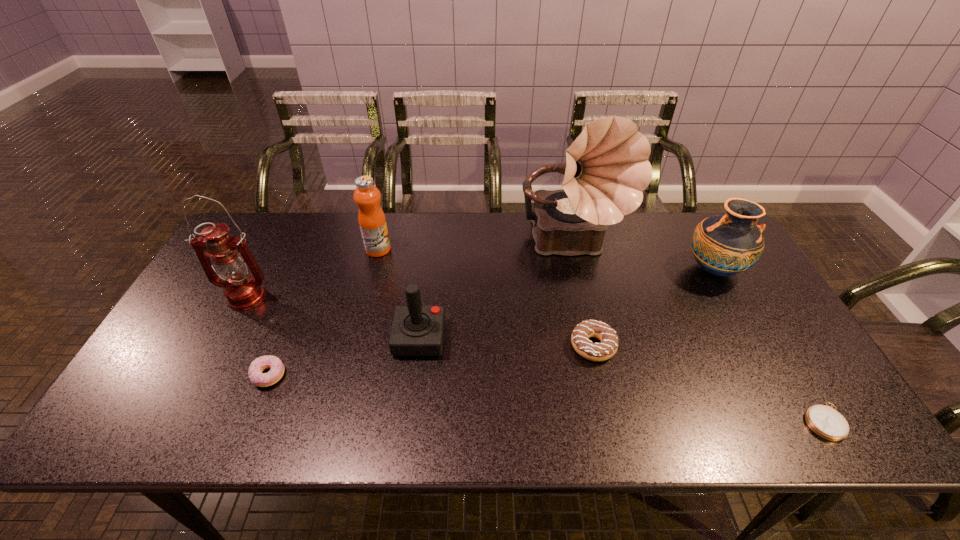
At what (x,y) coordinates should I click in order to perform the action: click on record player located in the far edge section of the desktop. Please return your answer as a coordinate pair (x, y). Looking at the image, I should click on (606, 169).

You are a GUI agent. You are given a task and a screenshot of the screen. Output one action in this format:
    pyautogui.click(x=<x>, y=<y>)
    Task: Click on the fruit juice that is at the far edge
    The image size is (960, 540).
    Given the screenshot: What is the action you would take?
    pyautogui.click(x=372, y=222)

Image resolution: width=960 pixels, height=540 pixels. What are the coordinates of `pottery that is at the far edge` in the screenshot? It's located at pos(724,245).

The height and width of the screenshot is (540, 960). Find the location of `object positioned at the near edge`. object positioned at the near edge is located at coordinates (823, 420).

Where is `object situated at the left edge`? object situated at the left edge is located at coordinates (242, 291).

Find the location of a particular element. Image resolution: width=960 pixels, height=540 pixels. pottery that is at the right edge is located at coordinates (724, 245).

In order to click on compass situated at the right edge in this screenshot , I will do `click(823, 420)`.

Find the location of a particular element. The image size is (960, 540). object present at the far right corner is located at coordinates (724, 245).

The width and height of the screenshot is (960, 540). Identify the location of object at the near right corner. (823, 420).

You are a GUI agent. You are given a task and a screenshot of the screen. Output one action in this format:
    pyautogui.click(x=<x>, y=<y>)
    Task: Click on the vacant space at the far edge of the desktop
    The image size is (960, 540).
    Given the screenshot: What is the action you would take?
    pyautogui.click(x=654, y=251)